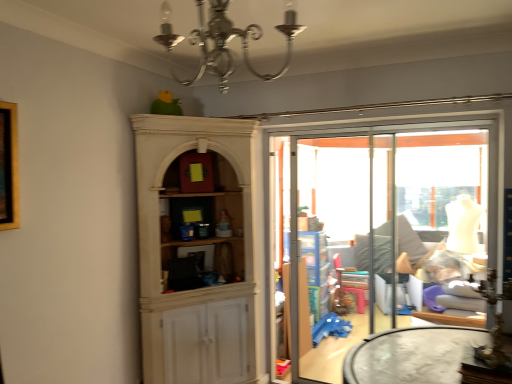
Question: Is silver metallic chandelier at upper center wider than transparent glass screen door at center?

Choices:
 (A) yes
 (B) no

Answer: (A)

Question: Is silver metallic chandelier at upper center at the right side of transparent glass screen door at center?

Choices:
 (A) yes
 (B) no

Answer: (B)

Question: Is silver metallic chandelier at upper center turned away from transparent glass screen door at center?

Choices:
 (A) yes
 (B) no

Answer: (B)

Question: Is silver metallic chandelier at upper center not within transparent glass screen door at center?

Choices:
 (A) no
 (B) yes

Answer: (B)

Question: Can transparent glass screen door at center be found inside silver metallic chandelier at upper center?

Choices:
 (A) no
 (B) yes

Answer: (A)

Question: In the image, is transparent glass screen door at center on the left side or the right side of silver metallic chandelier at upper center?

Choices:
 (A) right
 (B) left

Answer: (A)

Question: From a real-world perspective, relative to silver metallic chandelier at upper center, is transparent glass screen door at center vertically above or below?

Choices:
 (A) below
 (B) above

Answer: (A)

Question: Is transparent glass screen door at center in front of or behind silver metallic chandelier at upper center in the image?

Choices:
 (A) front
 (B) behind

Answer: (B)

Question: Considering the positions of transparent glass screen door at center and silver metallic chandelier at upper center in the image, is transparent glass screen door at center taller or shorter than silver metallic chandelier at upper center?

Choices:
 (A) short
 (B) tall

Answer: (B)

Question: Considering the relative positions of transparent glass window at center and transparent glass screen door at center in the image provided, is transparent glass window at center to the left or to the right of transparent glass screen door at center?

Choices:
 (A) right
 (B) left

Answer: (A)

Question: Is transparent glass window at center situated inside transparent glass screen door at center or outside?

Choices:
 (A) outside
 (B) inside

Answer: (A)

Question: Looking at the image, does transparent glass window at center seem bigger or smaller compared to transparent glass screen door at center?

Choices:
 (A) big
 (B) small

Answer: (B)

Question: From the image's perspective, relative to transparent glass screen door at center, is transparent glass window at center above or below?

Choices:
 (A) above
 (B) below

Answer: (A)

Question: Based on their positions, is silver metallic chandelier at upper center located to the left or right of transparent glass screen door at center?

Choices:
 (A) right
 (B) left

Answer: (B)

Question: Is silver metallic chandelier at upper center spatially inside transparent glass screen door at center, or outside of it?

Choices:
 (A) inside
 (B) outside

Answer: (B)